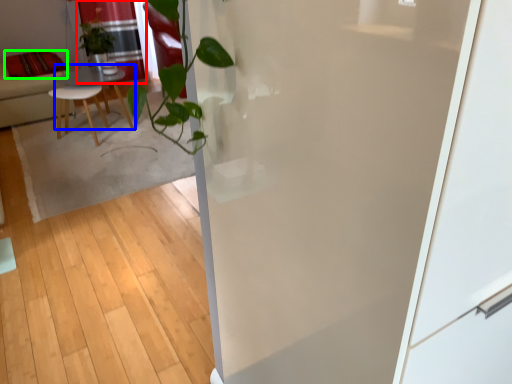
Question: Based on their relative distances, which object is farther from curtain (highlighted by a red box)? Choose from table (highlighted by a blue box) and pillow (highlighted by a green box).

Choices:
 (A) table
 (B) pillow

Answer: (B)